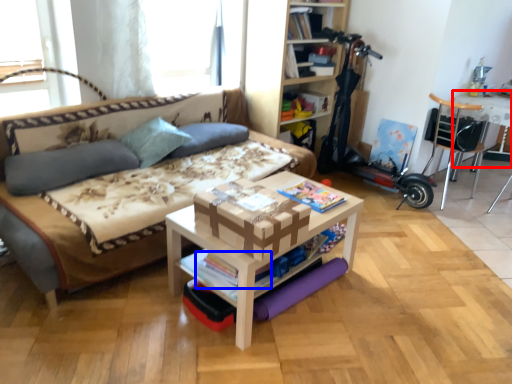
Question: Which of the following is the closest to the observer, table (highlighted by a red box) or magazine (highlighted by a blue box)?

Choices:
 (A) table
 (B) magazine

Answer: (B)